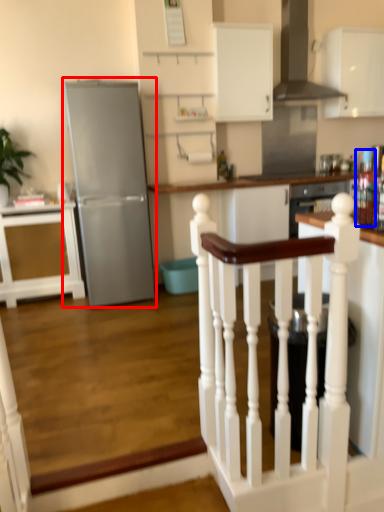
Question: Which of the following is the farthest to the observer, refrigerator (highlighted by a red box) or appliance (highlighted by a blue box)?

Choices:
 (A) refrigerator
 (B) appliance

Answer: (A)